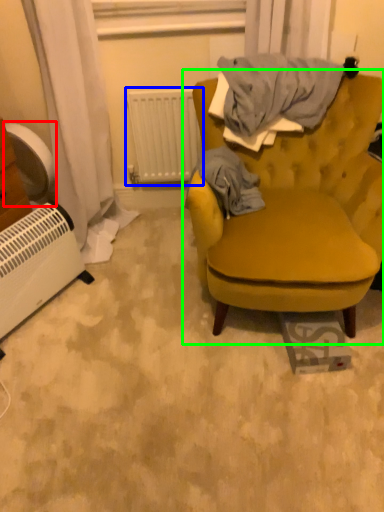
Question: Which object is the farthest from fan (highlighted by a red box)? Choose among these: radiator (highlighted by a blue box) or chair (highlighted by a green box).

Choices:
 (A) radiator
 (B) chair

Answer: (B)